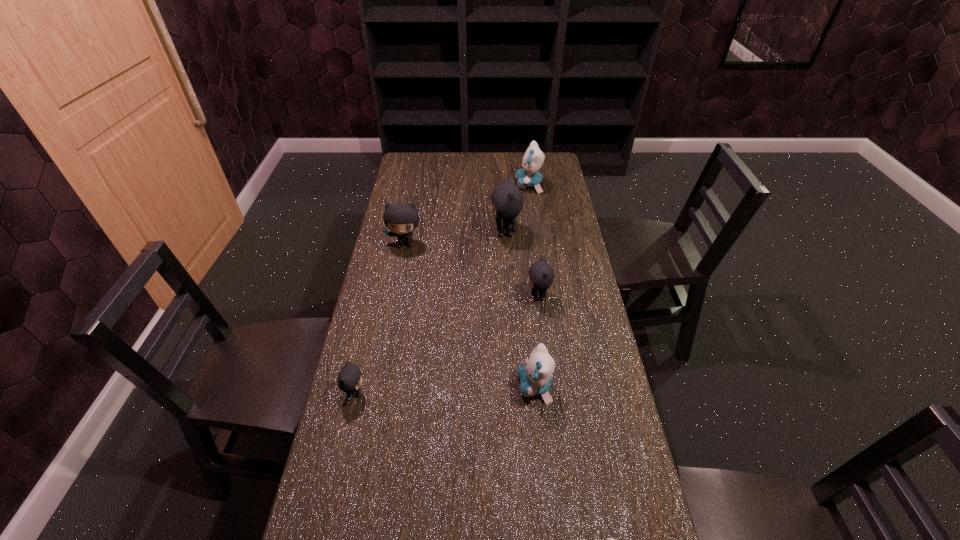
Find the location of `vacant space located on the front-facing side of the biggest gray kitten`. vacant space located on the front-facing side of the biggest gray kitten is located at coordinates (425, 232).

This screenshot has width=960, height=540. Find the location of `blank space located 0.270m on the face of the farthest kitten`. blank space located 0.270m on the face of the farthest kitten is located at coordinates (455, 185).

This screenshot has width=960, height=540. In order to click on vacant area situated on the face of the farthest kitten in this screenshot , I will do `click(500, 185)`.

This screenshot has height=540, width=960. Identify the location of vacant space located 0.150m on the face of the farthest kitten. (482, 185).

At what (x,y) coordinates should I click in order to perform the action: click on free space located on the front-facing side of the second biggest gray kitten. Please return your answer as a coordinate pair (x, y). The image size is (960, 540). Looking at the image, I should click on (392, 316).

Find the location of a particular element. The width and height of the screenshot is (960, 540). free spot located on the face of the second biggest blue kitten is located at coordinates (403, 387).

You are a GUI agent. You are given a task and a screenshot of the screen. Output one action in this format:
    pyautogui.click(x=<x>, y=<y>)
    Task: Click on the vacant space located 0.090m on the face of the second biggest blue kitten
    Image resolution: width=960 pixels, height=540 pixels.
    Given the screenshot: What is the action you would take?
    pyautogui.click(x=485, y=387)

Locate an element on the screen. The image size is (960, 540). vacant space situated on the face of the second biggest blue kitten is located at coordinates (482, 387).

Where is `vacant point located on the front-facing side of the fourth nearest object`? This screenshot has height=540, width=960. vacant point located on the front-facing side of the fourth nearest object is located at coordinates (451, 297).

The height and width of the screenshot is (540, 960). Identify the location of free location located on the front-facing side of the fourth nearest object. (454, 297).